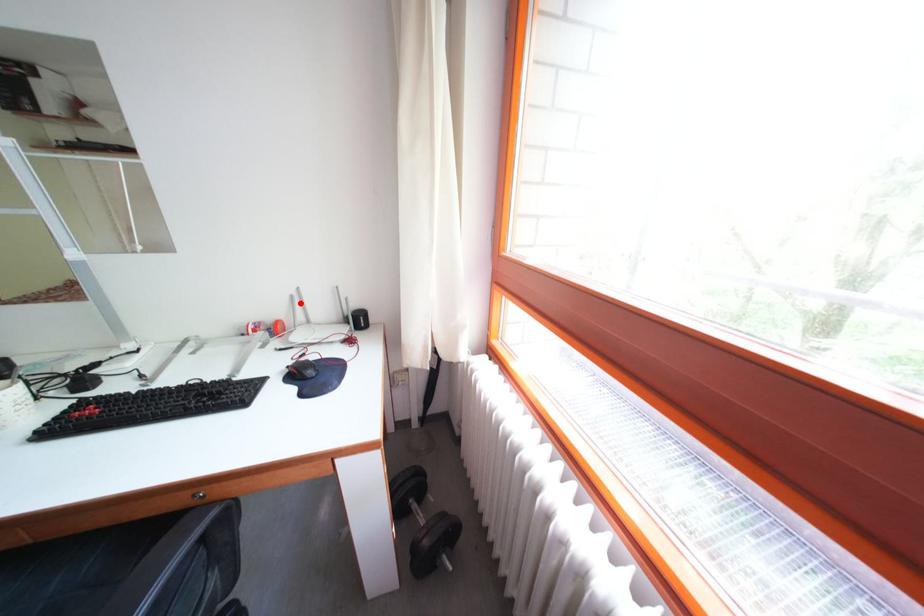
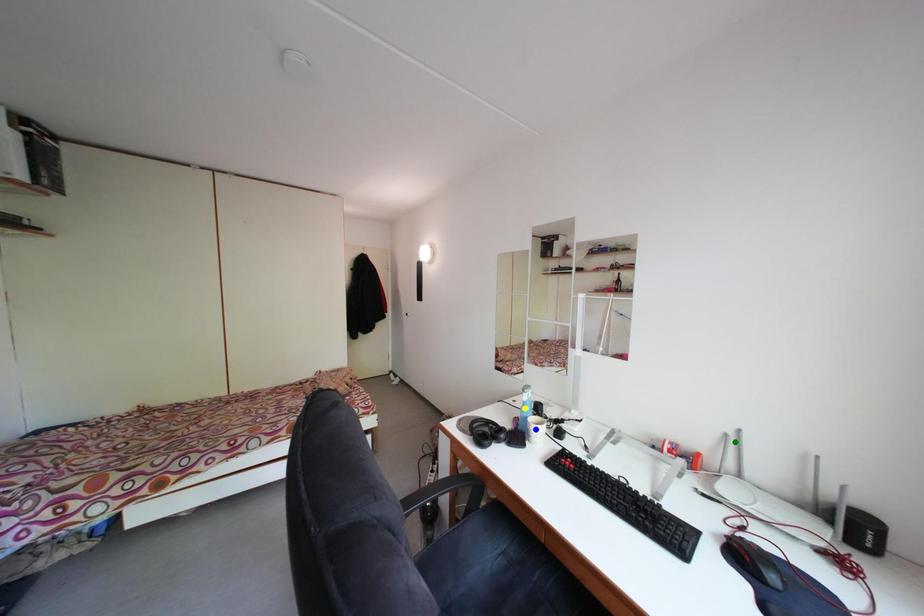
Question: I am providing you with two images of the same scene from different viewpoints. A red point is marked on the first image. You are given multiple points on the second image. Which spot in image 2 lines up with the point in image 1?

Choices:
 (A) blue point
 (B) green point
 (C) yellow point

Answer: (B)